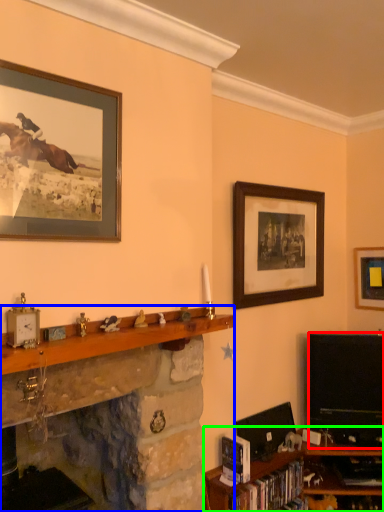
Question: Based on their relative distances, which object is nearer to television (highlighted by a red box)? Choose from shelf (highlighted by a blue box) and shelf (highlighted by a green box).

Choices:
 (A) shelf
 (B) shelf

Answer: (B)